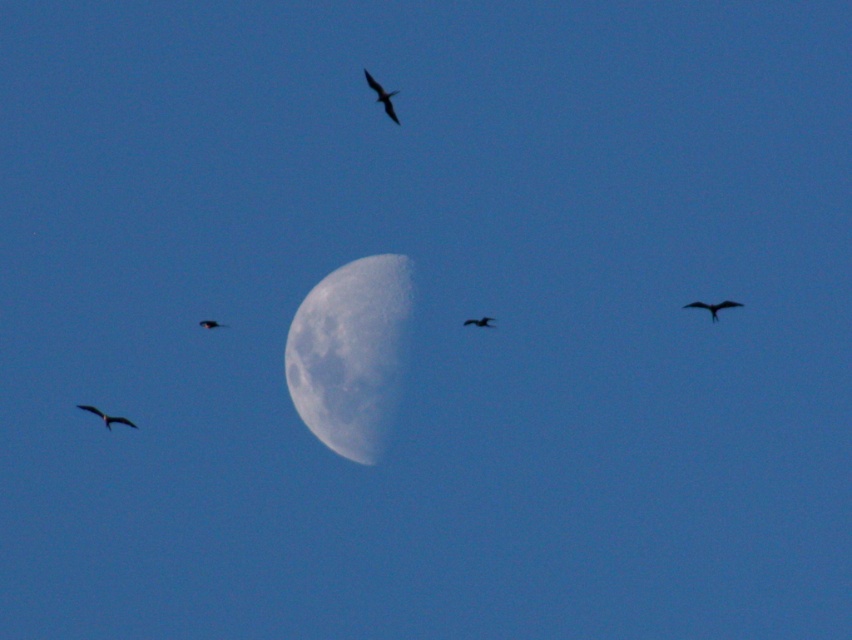
Question: Where is black matte bird at upper center located in relation to silhouette glossy bird at center in the image?

Choices:
 (A) right
 (B) left

Answer: (B)

Question: Which object is closer to the camera taking this photo?

Choices:
 (A) black matte bird at upper right
 (B) black matte bird at lower left
 (C) silhouette glossy bird at center

Answer: (A)

Question: Does black matte bird at upper center have a greater width compared to matte black bird at upper center?

Choices:
 (A) yes
 (B) no

Answer: (A)

Question: Is black matte bird at upper center bigger than silhouette glossy bird at center?

Choices:
 (A) no
 (B) yes

Answer: (B)

Question: Which point appears farthest from the camera in this image?

Choices:
 (A) (220, 324)
 (B) (131, 422)
 (C) (714, 314)

Answer: (A)

Question: Estimate the real-world distances between objects in this image. Which object is farther from the matte black bird at upper center?

Choices:
 (A) black matte bird at upper right
 (B) black matte bird at lower left
 (C) silhouette glossy bird at center
 (D) slightly grayish-white textured moon at center

Answer: (A)